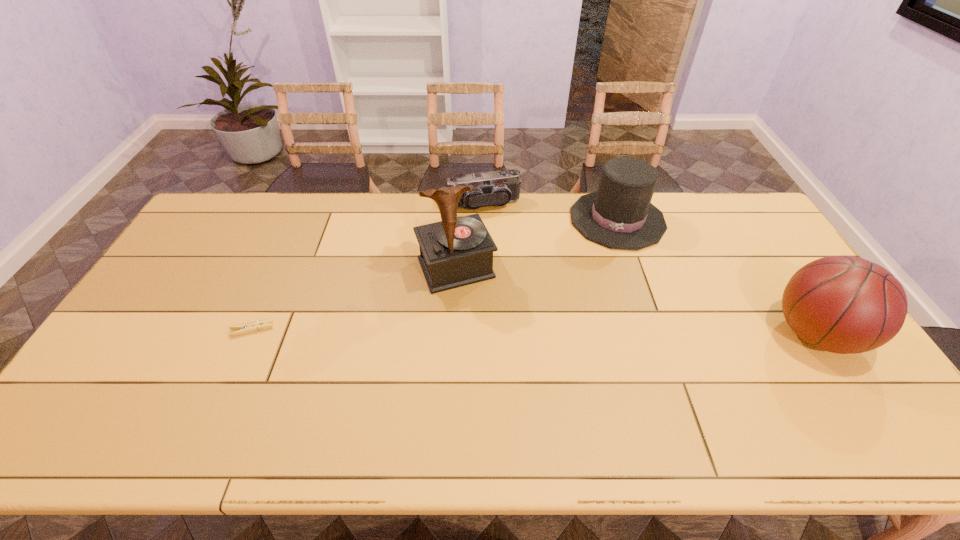
You are a GUI agent. You are given a task and a screenshot of the screen. Output one action in this format:
    pyautogui.click(x=<x>, y=<y>)
    Task: Click on the camcorder that is at the far edge
    The height and width of the screenshot is (540, 960).
    Given the screenshot: What is the action you would take?
    coord(498,188)

You are a GUI agent. You are given a task and a screenshot of the screen. Output one action in this format:
    pyautogui.click(x=<x>, y=<y>)
    Task: Click on the object that is at the right edge
    The width and height of the screenshot is (960, 540).
    Given the screenshot: What is the action you would take?
    pyautogui.click(x=843, y=304)

Identify the location of vacant space at the far edge. The height and width of the screenshot is (540, 960). (524, 234).

This screenshot has width=960, height=540. Find the location of `vacant point at the near edge`. vacant point at the near edge is located at coordinates (575, 396).

Where is `free region at the left edge of the desktop`? The image size is (960, 540). free region at the left edge of the desktop is located at coordinates (108, 357).

The image size is (960, 540). Find the location of `vacant space at the right edge`. vacant space at the right edge is located at coordinates (780, 299).

Locate an element on the screen. Image resolution: width=960 pixels, height=540 pixels. vacant region at the far left corner of the desktop is located at coordinates (243, 218).

In the image, there is a desktop. Where is `vacant space at the far right corner`? This screenshot has width=960, height=540. vacant space at the far right corner is located at coordinates (718, 204).

Where is `vacant area that lies between the shortest object and the phonograph_record`? The width and height of the screenshot is (960, 540). vacant area that lies between the shortest object and the phonograph_record is located at coordinates (354, 299).

Identify the location of free spot between the fourth tallest object and the leftmost object. (368, 267).